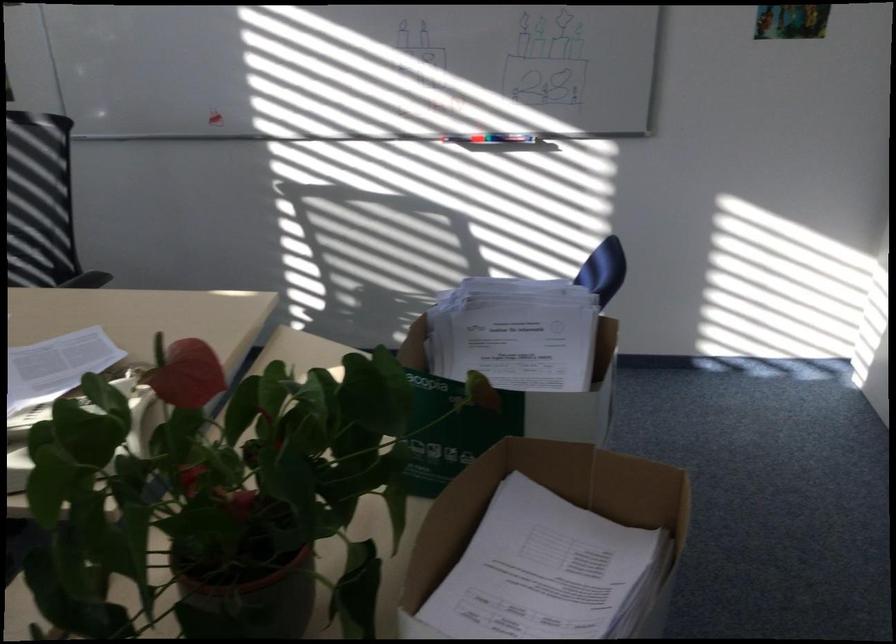
Find where to writ the whiteboard marker. Please return your answer as a coordinate pair (x, y).

(488, 138)